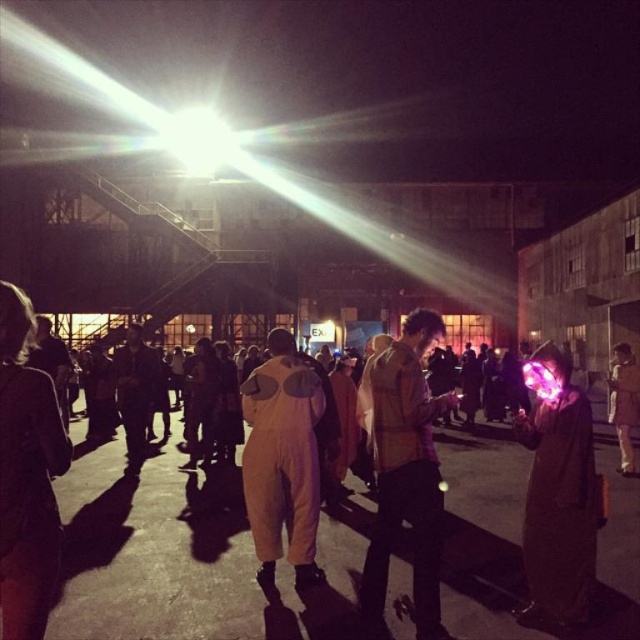
Based on the photo, you are standing at the entrance of the venue and want to reach a specific point marked at coordinates point (272,484). The venue has a rule that you must stay within 20 feet of the entrance. Can you safely reach this point without violating the rule?

The distance of point (272,484) from viewer is 18.35 feet, which is within the 20 feet limit. Therefore, you can safely reach the point without violating the venue rule.

You are at a party and want to locate the light brown leather jacket at lower left and the dark fabric jacket at center. From the perspective of someone standing at the entrance, which jacket is positioned more to the left?

The dark fabric jacket at center is more to the left since the light brown leather jacket at lower left is to the right of it.